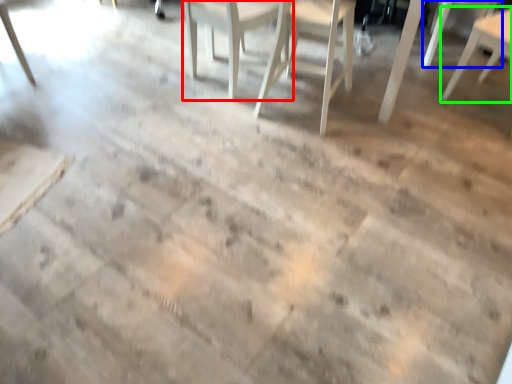
Question: Which object is the farthest from chair (highlighted by a red box)? Choose among these: chair (highlighted by a blue box) or chair (highlighted by a green box).

Choices:
 (A) chair
 (B) chair

Answer: (A)